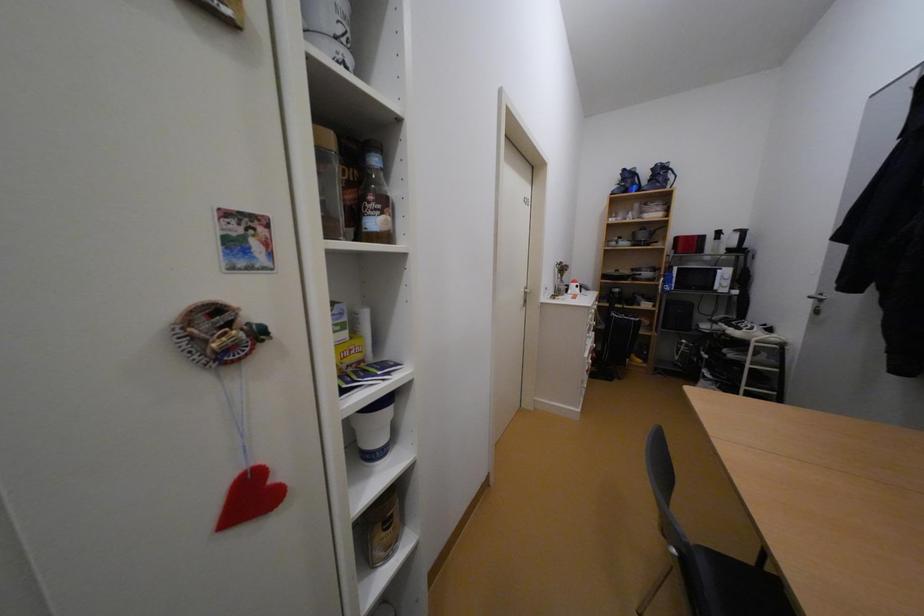
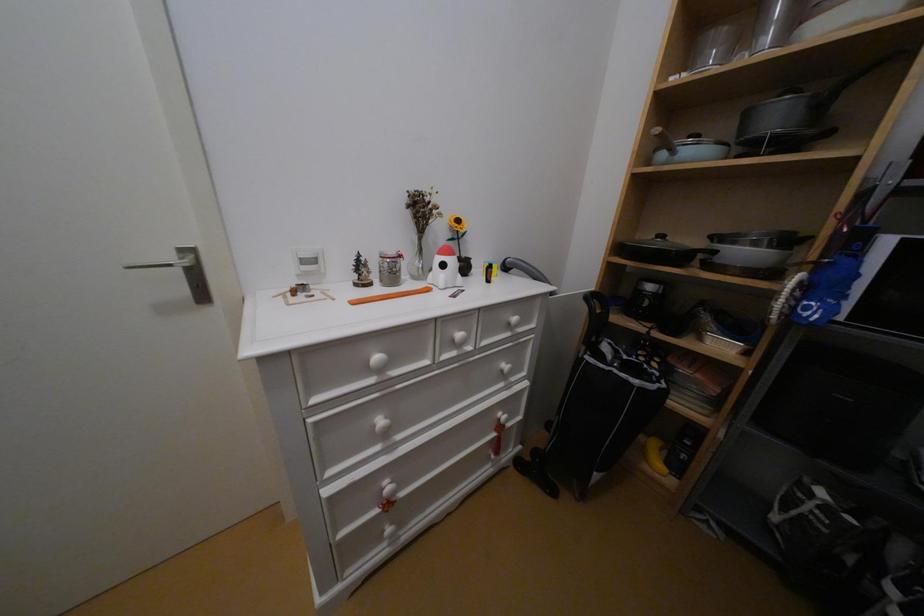
Consider the image. What movement of the cameraman would produce the second image?

The cameraman moved toward right, forward.